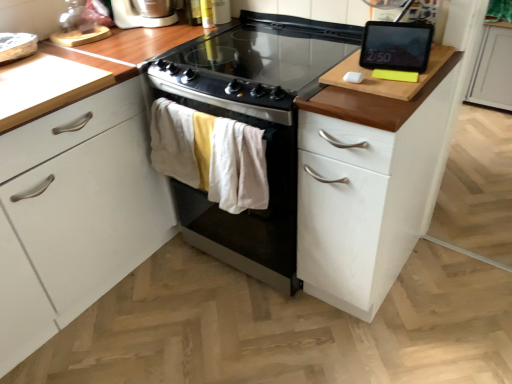
I want to click on free spot in front of black glass-top oven at center, so click(264, 334).